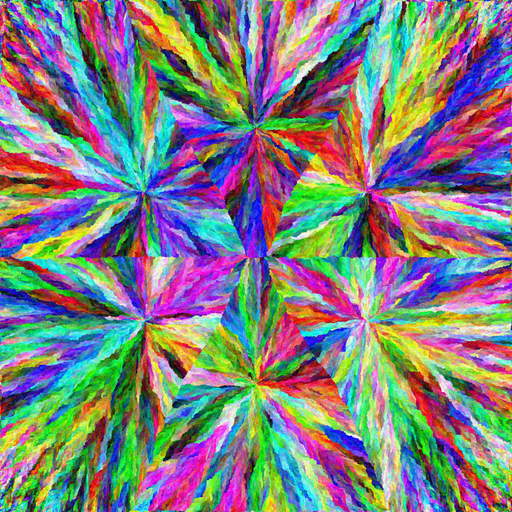
Find the location of a particular element. The image size is (512, 512). pink paint is located at coordinates (234, 490), (188, 468), (169, 281), (322, 286), (392, 269), (435, 157).